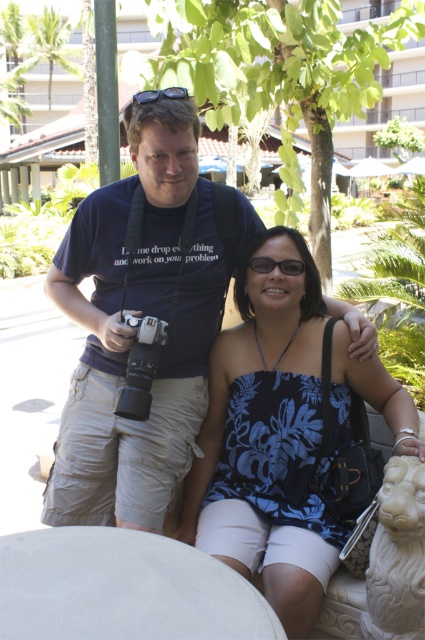
Question: Does matte blue shirt at center appear under silver metallic camera at center?

Choices:
 (A) yes
 (B) no

Answer: (B)

Question: Based on their relative distances, which object is nearer to the silver metallic camera at center?

Choices:
 (A) matte blue shirt at center
 (B) blue floral tank top at center

Answer: (A)

Question: Does matte blue shirt at center have a lesser width compared to blue floral tank top at center?

Choices:
 (A) yes
 (B) no

Answer: (B)

Question: Which point appears closest to the camera in this image?

Choices:
 (A) (88, 336)
 (B) (229, 406)
 (C) (127, 417)

Answer: (C)

Question: Which point appears closest to the camera in this image?

Choices:
 (A) (152, 323)
 (B) (96, 404)
 (C) (275, 385)

Answer: (A)

Question: Can you confirm if matte blue shirt at center is positioned above silver metallic camera at center?

Choices:
 (A) yes
 (B) no

Answer: (A)